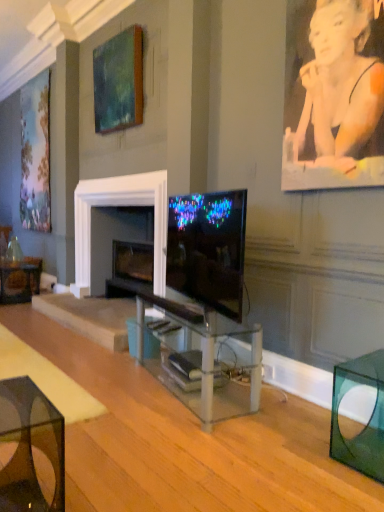
Question: Is transparent glass cube at lower right, the 1th table positioned from the right, inside or outside of pastel floral fabric at left, positioned as the 2th picture frame in front-to-back order?

Choices:
 (A) outside
 (B) inside

Answer: (A)

Question: Considering the positions of transparent glass cube at lower right, the third table from the back, and pastel floral fabric at left, placed as the 1th picture frame when sorted from left to right, in the image, is transparent glass cube at lower right, the third table from the back, wider or thinner than pastel floral fabric at left, placed as the 1th picture frame when sorted from left to right,?

Choices:
 (A) thin
 (B) wide

Answer: (B)

Question: Which is nearer to the matte black tv at center?

Choices:
 (A) blue plastic trash bin at center
 (B) black plastic remote control at center, which appears as the 2th remote control when viewed from the back
 (C) black plastic remote control at center, the first remote control from the back
 (D) pastel floral fabric at left, the second picture frame in the right-to-left sequence
 (E) transparent glass table at center, positioned as the 3th table in front-to-back order

Answer: (E)

Question: Estimate the real-world distances between objects in this image. Which object is closer to the matte black tv at center?

Choices:
 (A) black plastic remote control at center, the first remote control from the back
 (B) transparent glass table at lower left, which ranks as the 1th table in front-to-back order
 (C) translucent glass table at lower left, the 4th table from the front
 (D) pastel floral fabric at left, the 1th picture frame in the back-to-front sequence
 (E) teal matte painting at upper center, arranged as the 1th picture frame when viewed from the right

Answer: (A)